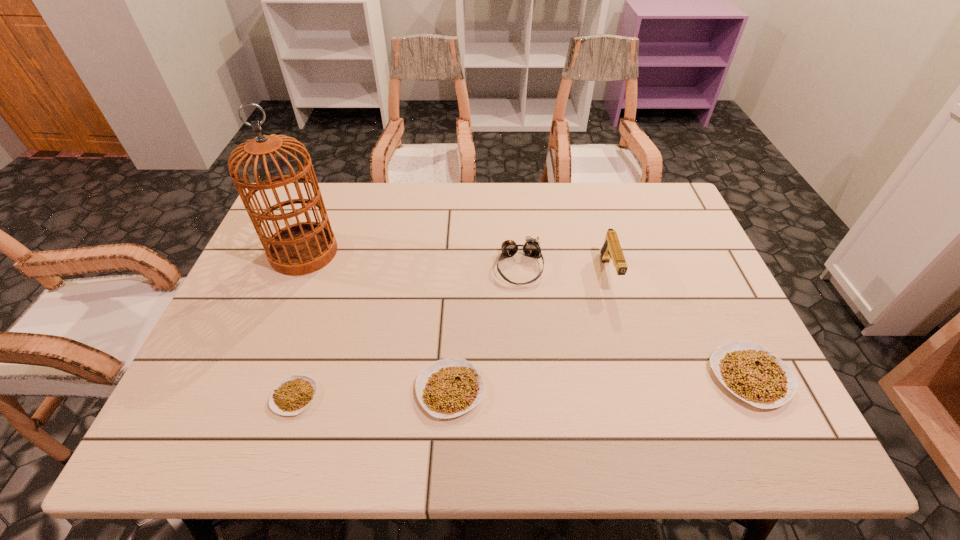
If equal spacing is desired by inserting an extra legume among them, please point out a free spot for this new legume. Please provide its 2D coordinates. Your answer should be formatted as a tuple, i.e. [(x, y)], where the tuple contains the x and y coordinates of a point satisfying the conditions above.

[(602, 383)]